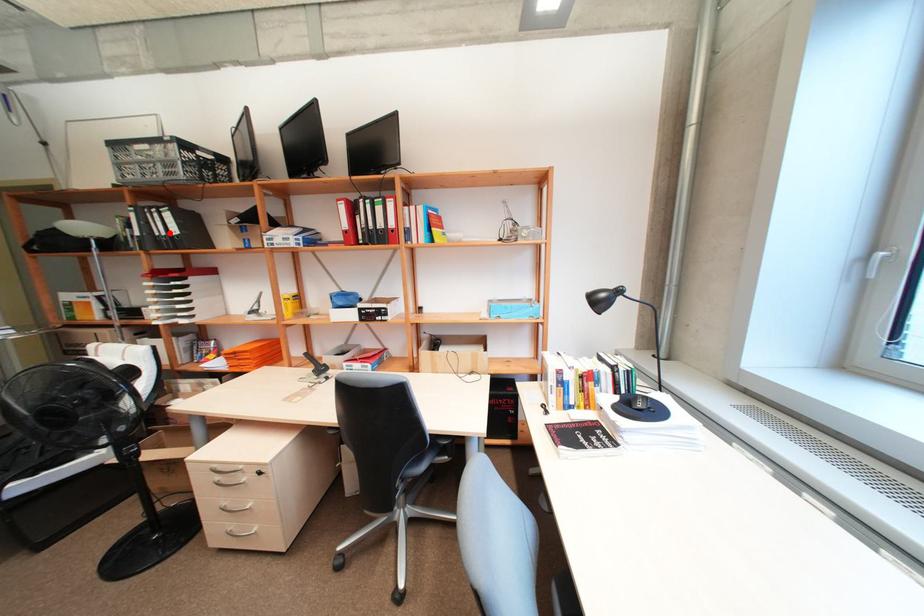
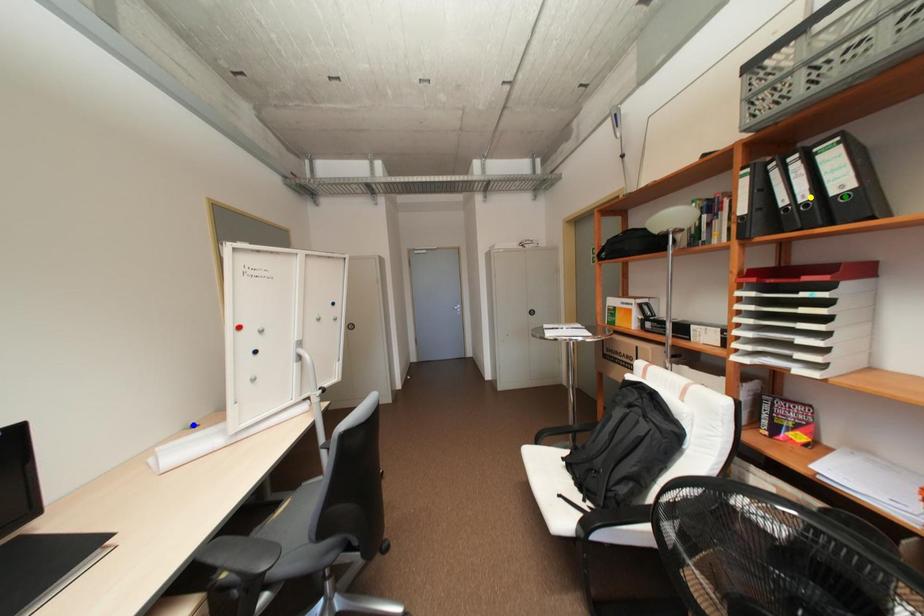
Question: I am providing you with two images of the same scene from different viewpoints. A red point is marked on the first image. You are given multiple points on the second image. Can you choose the point in image 2 that corresponds to the point in image 1?

Choices:
 (A) green point
 (B) blue point
 (C) yellow point

Answer: (C)